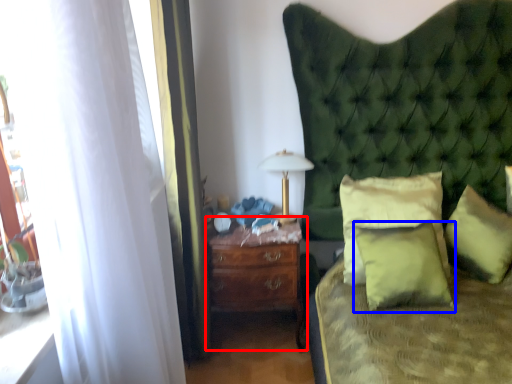
Question: Which object is closer to the camera taking this photo, nightstand (highlighted by a red box) or pillow (highlighted by a blue box)?

Choices:
 (A) nightstand
 (B) pillow

Answer: (B)